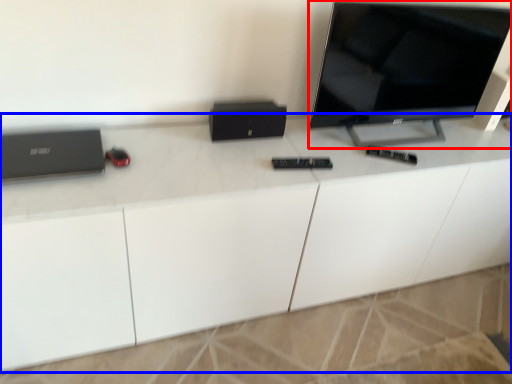
Question: Which of the following is the farthest to the observer, television (highlighted by a red box) or desk (highlighted by a blue box)?

Choices:
 (A) television
 (B) desk

Answer: (A)